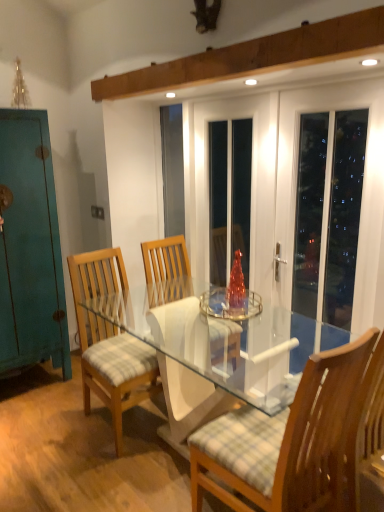
This screenshot has width=384, height=512. In order to click on vacant area that is in front of teal matte cabinet at left in this screenshot , I will do [x=30, y=417].